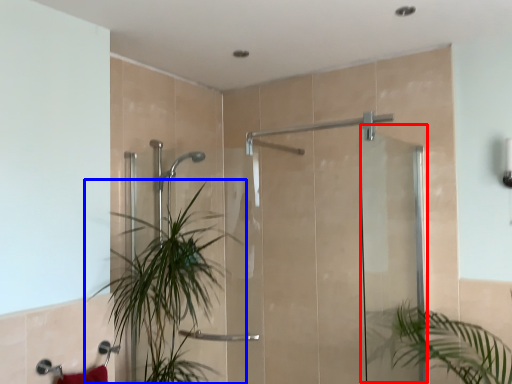
Question: Which object appears farthest to the camera in this image, screen door (highlighted by a red box) or houseplant (highlighted by a blue box)?

Choices:
 (A) screen door
 (B) houseplant

Answer: (B)